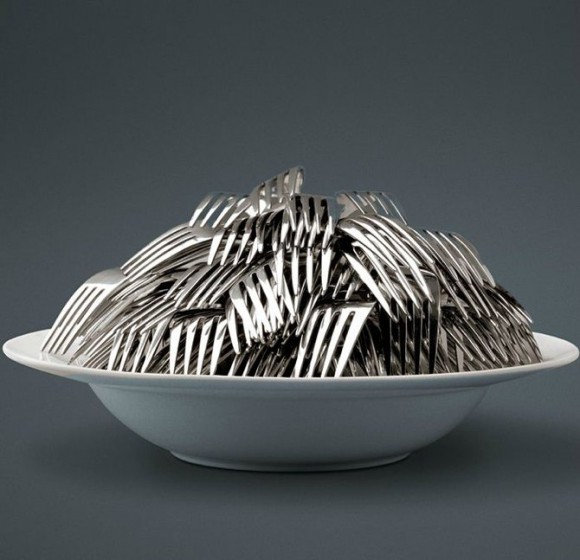
Where is `right edge of bowl`? right edge of bowl is located at coordinates (577, 354).